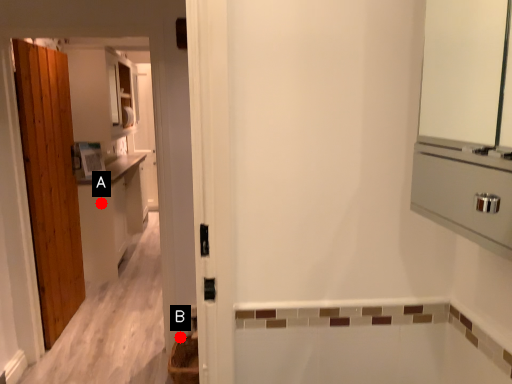
Question: Two points are circled on the image, labeled by A and B beside each circle. Which point is farther to the camera?

Choices:
 (A) A is further
 (B) B is further

Answer: (A)